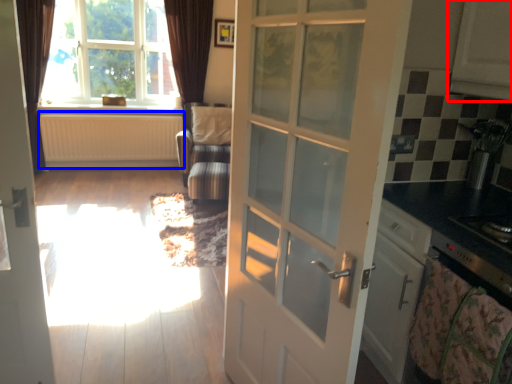
Question: Which point is further to the camera, cabinetry (highlighted by a red box) or radiator (highlighted by a blue box)?

Choices:
 (A) cabinetry
 (B) radiator

Answer: (B)